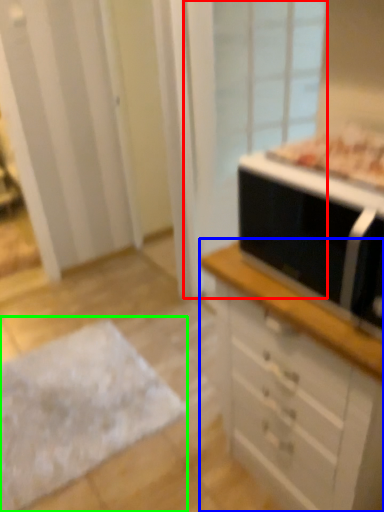
Question: Which object is positioned farthest from screen door (highlighted by a red box)? Select from chest of drawers (highlighted by a blue box) and flat (highlighted by a green box).

Choices:
 (A) chest of drawers
 (B) flat

Answer: (A)